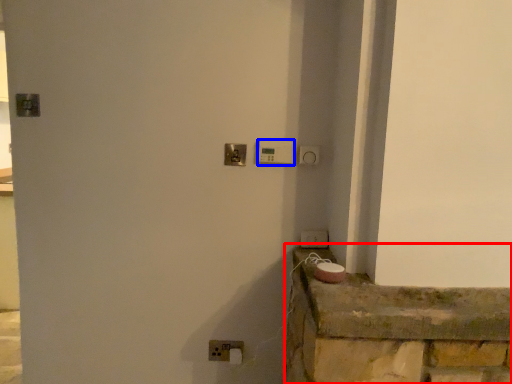
Question: Which object appears farthest to the camera in this image, ledge (highlighted by a red box) or light switch (highlighted by a blue box)?

Choices:
 (A) ledge
 (B) light switch

Answer: (B)